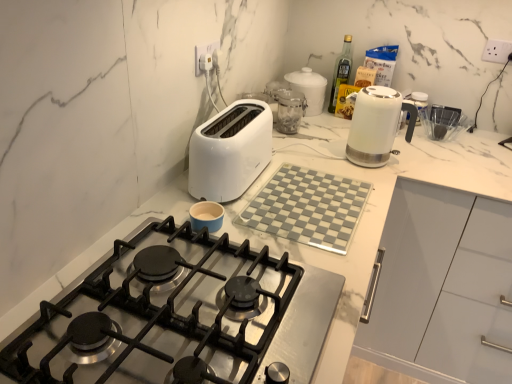
Where is `clear glass bottle at upper right`? Image resolution: width=512 pixels, height=384 pixels. clear glass bottle at upper right is located at coordinates pos(341,71).

The width and height of the screenshot is (512, 384). Describe the element at coordinates (374, 210) in the screenshot. I see `white marble cutting board at upper center` at that location.

Describe the element at coordinates (376, 125) in the screenshot. The height and width of the screenshot is (384, 512). I see `white glossy electric kettle at upper right, the third kitchen appliance from the back` at that location.

What do you see at coordinates (179, 316) in the screenshot? I see `stainless steel gas stove at center` at bounding box center [179, 316].

You are a GUI agent. You are given a task and a screenshot of the screen. Output one action in this format:
    pyautogui.click(x=<x>, y=<y>)
    Task: Click on the white plastic toaster at center
    The image size is (512, 384).
    Given the screenshot: What is the action you would take?
    pyautogui.click(x=230, y=151)

From a real-world perspective, is white glossy jar at upper center, marked as the 1th kitchen appliance in a back-to-front arrangement, on white plastic toaster at center?

Actually, white glossy jar at upper center, marked as the 1th kitchen appliance in a back-to-front arrangement, is physically below white plastic toaster at center in the real world.

How different are the orientations of white glossy jar at upper center, placed as the 3th kitchen appliance when sorted from front to back, and white plastic toaster at center in degrees?

white glossy jar at upper center, placed as the 3th kitchen appliance when sorted from front to back, and white plastic toaster at center are facing 0.986 degrees away from each other.

Does white glossy jar at upper center, placed as the 3th kitchen appliance when sorted from front to back, touch white plastic toaster at center?

white glossy jar at upper center, placed as the 3th kitchen appliance when sorted from front to back, is not next to white plastic toaster at center, and they're not touching.

Considering the relative sizes of white glossy jar at upper center, placed as the 3th kitchen appliance when sorted from front to back, and white plastic toaster at center in the image provided, is white glossy jar at upper center, placed as the 3th kitchen appliance when sorted from front to back, bigger than white plastic toaster at center?

Incorrect, white glossy jar at upper center, placed as the 3th kitchen appliance when sorted from front to back, is not larger than white plastic toaster at center.

Which object is positioned more to the left, clear glass jar at center, which ranks as the second kitchen appliance in front-to-back order, or white marble cutting board at upper center?

clear glass jar at center, which ranks as the second kitchen appliance in front-to-back order, is more to the left.

Would you say white marble cutting board at upper center is part of clear glass jar at center, which appears as the second kitchen appliance when viewed from the back,'s contents?

No, white marble cutting board at upper center is not a part of clear glass jar at center, which appears as the second kitchen appliance when viewed from the back.

Is clear glass jar at center, which ranks as the second kitchen appliance in front-to-back order, positioned with its back to white marble cutting board at upper center?

No.

Can you confirm if clear glass jar at center, which appears as the second kitchen appliance when viewed from the back, is wider than white glossy electric kettle at upper right, the third kitchen appliance from the back?

No, clear glass jar at center, which appears as the second kitchen appliance when viewed from the back, is not wider than white glossy electric kettle at upper right, the third kitchen appliance from the back.

From their relative heights in the image, would you say clear glass jar at center, which ranks as the second kitchen appliance in front-to-back order, is taller or shorter than white glossy electric kettle at upper right, the third kitchen appliance from the back?

Considering their sizes, clear glass jar at center, which ranks as the second kitchen appliance in front-to-back order, has less height than white glossy electric kettle at upper right, the third kitchen appliance from the back.

In the image, is clear glass jar at center, which appears as the second kitchen appliance when viewed from the back, positioned in front of or behind white glossy electric kettle at upper right, which is counted as the first kitchen appliance, starting from the front?

In the image, clear glass jar at center, which appears as the second kitchen appliance when viewed from the back, appears behind white glossy electric kettle at upper right, which is counted as the first kitchen appliance, starting from the front.

There is a white plastic toaster at center. Find the location of `the 2nd kitchen appliance above it (from the image's perspective)`. the 2nd kitchen appliance above it (from the image's perspective) is located at coordinates (289, 110).

Is clear glass jar at center, which appears as the second kitchen appliance when viewed from the back, taller than white plastic toaster at center?

No, clear glass jar at center, which appears as the second kitchen appliance when viewed from the back, is not taller than white plastic toaster at center.

Considering the relative sizes of clear glass jar at center, which ranks as the second kitchen appliance in front-to-back order, and white plastic toaster at center in the image provided, is clear glass jar at center, which ranks as the second kitchen appliance in front-to-back order, smaller than white plastic toaster at center?

Yes.

Would you say white plastic toaster at center is part of clear glass jar at center, which ranks as the second kitchen appliance in front-to-back order,'s contents?

No, white plastic toaster at center is not surrounded by clear glass jar at center, which ranks as the second kitchen appliance in front-to-back order.

From a real-world perspective, between white plastic toaster at center and white glossy jar at upper center, placed as the 3th kitchen appliance when sorted from front to back, who is vertically lower?

In real-world perspective, white glossy jar at upper center, placed as the 3th kitchen appliance when sorted from front to back, is lower.

Which kitchen appliance is the 2nd one when counting from the right side of the white plastic toaster at center? Please provide its 2D coordinates.

[(309, 89)]

In the scene shown: Considering the sizes of objects white plastic toaster at center and white glossy jar at upper center, marked as the 1th kitchen appliance in a back-to-front arrangement, in the image provided, who is bigger, white plastic toaster at center or white glossy jar at upper center, marked as the 1th kitchen appliance in a back-to-front arrangement,?

white plastic toaster at center is bigger.

Can we say stainless steel gas stove at center lies outside white glossy electric kettle at upper right, which is counted as the first kitchen appliance, starting from the front?

That's correct, stainless steel gas stove at center is outside of white glossy electric kettle at upper right, which is counted as the first kitchen appliance, starting from the front.

Is stainless steel gas stove at center thinner than white glossy electric kettle at upper right, which is counted as the first kitchen appliance, starting from the front?

No.

From a real-world perspective, is stainless steel gas stove at center above or below white glossy electric kettle at upper right, which is counted as the first kitchen appliance, starting from the front?

In terms of real-world spatial position, stainless steel gas stove at center is below white glossy electric kettle at upper right, which is counted as the first kitchen appliance, starting from the front.

Based on the photo, between stainless steel gas stove at center and white glossy jar at upper center, marked as the 1th kitchen appliance in a back-to-front arrangement, which one is positioned in front?

stainless steel gas stove at center is in front.

From the stainless steel gas stove at center, count 3rd kitchen appliances backward and point to it. Please provide its 2D coordinates.

[(309, 89)]

Which point is more distant from viewer, (61, 359) or (288, 74)?

The point (288, 74) is farther.

Is white glossy jar at upper center, placed as the 3th kitchen appliance when sorted from front to back, at the back of stainless steel gas stove at center?

stainless steel gas stove at center does not have its back to white glossy jar at upper center, placed as the 3th kitchen appliance when sorted from front to back.

The image size is (512, 384). Identify the location of toaster lying on the left of white glossy jar at upper center, placed as the 3th kitchen appliance when sorted from front to back. (230, 151).

This screenshot has height=384, width=512. In order to click on countertop in front of the clear glass jar at center, which ranks as the second kitchen appliance in front-to-back order in this screenshot , I will do `click(374, 210)`.

Which object lies further to the anchor point white plastic toaster at center, stainless steel gas stove at center or clear glass jar at center, which appears as the second kitchen appliance when viewed from the back?

clear glass jar at center, which appears as the second kitchen appliance when viewed from the back, lies further to white plastic toaster at center than the other object.

Looking at the image, which one is located further to clear glass jar at center, which appears as the second kitchen appliance when viewed from the back, stainless steel gas stove at center or white glossy electric kettle at upper right, the third kitchen appliance from the back?

Based on the image, stainless steel gas stove at center appears to be further to clear glass jar at center, which appears as the second kitchen appliance when viewed from the back.

Which object lies further to the anchor point white glossy jar at upper center, marked as the 1th kitchen appliance in a back-to-front arrangement, white marble cutting board at upper center or white glossy electric kettle at upper right, the third kitchen appliance from the back?

The object further to white glossy jar at upper center, marked as the 1th kitchen appliance in a back-to-front arrangement, is white marble cutting board at upper center.

Which object lies nearer to the anchor point white marble cutting board at upper center, white plastic toaster at center or clear glass bottle at upper right?

white plastic toaster at center is positioned closer to the anchor white marble cutting board at upper center.

Estimate the real-world distances between objects in this image. Which object is further from stainless steel gas stove at center, clear glass jar at center, which ranks as the second kitchen appliance in front-to-back order, or white plastic toaster at center?

Among the two, clear glass jar at center, which ranks as the second kitchen appliance in front-to-back order, is located further to stainless steel gas stove at center.

Considering their positions, is clear glass jar at center, which appears as the second kitchen appliance when viewed from the back, positioned further to white glossy jar at upper center, marked as the 1th kitchen appliance in a back-to-front arrangement, than stainless steel gas stove at center?

stainless steel gas stove at center is positioned further to the anchor white glossy jar at upper center, marked as the 1th kitchen appliance in a back-to-front arrangement.

Considering their positions, is stainless steel gas stove at center positioned closer to white glossy electric kettle at upper right, the third kitchen appliance from the back, than clear glass jar at center, which appears as the second kitchen appliance when viewed from the back?

clear glass jar at center, which appears as the second kitchen appliance when viewed from the back, is positioned closer to the anchor white glossy electric kettle at upper right, the third kitchen appliance from the back.

Estimate the real-world distances between objects in this image. Which object is closer to white glossy electric kettle at upper right, which is counted as the first kitchen appliance, starting from the front, clear glass bottle at upper right or white marble cutting board at upper center?

white marble cutting board at upper center lies closer to white glossy electric kettle at upper right, which is counted as the first kitchen appliance, starting from the front, than the other object.

The height and width of the screenshot is (384, 512). I want to click on countertop between stainless steel gas stove at center and white glossy electric kettle at upper right, the third kitchen appliance from the back, in the front-back direction, so tap(374, 210).

Where is `kitchen appliance located between white plastic toaster at center and clear glass jar at center, which ranks as the second kitchen appliance in front-to-back order, in the depth direction`? This screenshot has width=512, height=384. kitchen appliance located between white plastic toaster at center and clear glass jar at center, which ranks as the second kitchen appliance in front-to-back order, in the depth direction is located at coordinates (376, 125).

In order to click on toaster positioned between stainless steel gas stove at center and clear glass bottle at upper right from near to far in this screenshot , I will do (230, 151).

Find the location of a particular element. toaster between stainless steel gas stove at center and white glossy electric kettle at upper right, which is counted as the first kitchen appliance, starting from the front, along the z-axis is located at coordinates (230, 151).